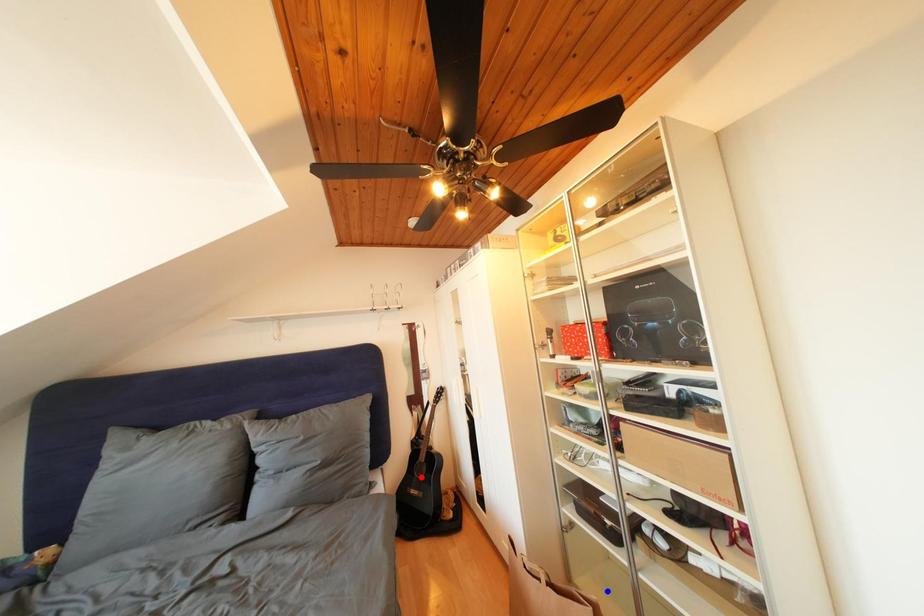
Question: In the image, two points are highlighted. Which point is nearer to the camera? Reply with the corresponding letter.

Choices:
 (A) blue point
 (B) red point

Answer: (A)